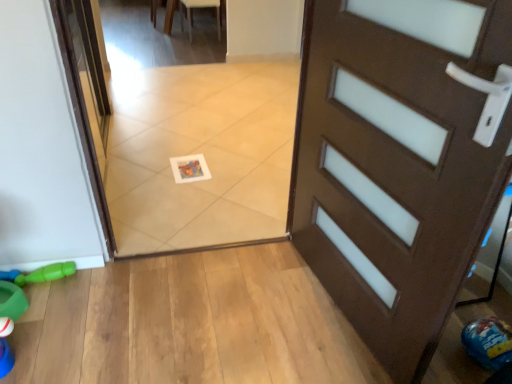
Question: Is green rubber toy at lower left in front of or behind white leather chair at upper center in the image?

Choices:
 (A) behind
 (B) front

Answer: (B)

Question: Considering the positions of green rubber toy at lower left and white leather chair at upper center in the image, is green rubber toy at lower left taller or shorter than white leather chair at upper center?

Choices:
 (A) short
 (B) tall

Answer: (A)

Question: Is point tap(45, 279) positioned closer to the camera than point tap(192, 6)?

Choices:
 (A) farther
 (B) closer

Answer: (B)

Question: From the image's perspective, is white leather chair at upper center located above or below green rubber toy at lower left?

Choices:
 (A) below
 (B) above

Answer: (B)

Question: Is white leather chair at upper center wider or thinner than green rubber toy at lower left?

Choices:
 (A) wide
 (B) thin

Answer: (A)

Question: Is white leather chair at upper center in front of or behind green rubber toy at lower left in the image?

Choices:
 (A) behind
 (B) front

Answer: (A)

Question: From a real-world perspective, relative to green rubber toy at lower left, is white leather chair at upper center vertically above or below?

Choices:
 (A) below
 (B) above

Answer: (B)